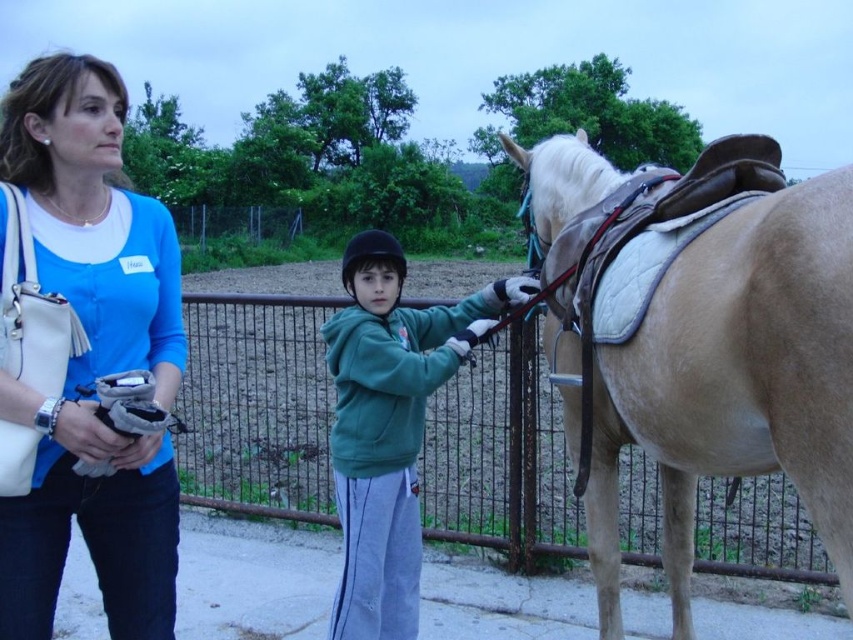
You are a delivery person trying to deliver a package to the light brown leather saddle at right. The rusty metal fence at center is blocking your path. Can you estimate if the space between the fence and the saddle is wide enough for you to pass through?

The light brown leather saddle at right occupies less space than the rusty metal fence at center, so the space between them might be narrow. However, without knowing the exact distance, it is difficult to determine if it is wide enough for the delivery person to pass through safely.

You are a photographer trying to capture a photo of the rusty metal fence at center and the blue fabric shirt at upper left. Which object should you zoom in on to make them appear the same size in the photo?

The rusty metal fence at center is larger in size than the blue fabric shirt at upper left, so you should zoom in on the blue fabric shirt at upper left to make them appear the same size in the photo.

Consider the image. You are a delivery person who needs to place a package between the light brown leather saddle at right and the rusty metal fence at center. Can you fit the package there?

The light brown leather saddle at right is positioned on the right side of the rusty metal fence at center, so there is space between them to place the package.